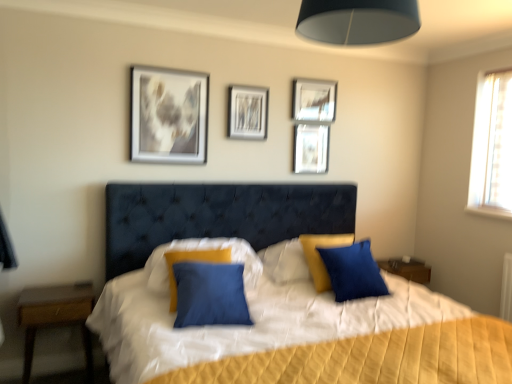
Question: Is wooden nightstand at left shorter than metallic silver picture frame at upper center, which is the 1th picture frame in right-to-left order?

Choices:
 (A) yes
 (B) no

Answer: (B)

Question: Does wooden nightstand at left have a smaller size compared to metallic silver picture frame at upper center, which is the 1th picture frame in right-to-left order?

Choices:
 (A) no
 (B) yes

Answer: (A)

Question: Considering the relative sizes of wooden nightstand at left and metallic silver picture frame at upper center, which is the 1th picture frame in right-to-left order, in the image provided, is wooden nightstand at left thinner than metallic silver picture frame at upper center, which is the 1th picture frame in right-to-left order,?

Choices:
 (A) no
 (B) yes

Answer: (A)

Question: Is wooden nightstand at left positioned behind metallic silver picture frame at upper center, which is the 1th picture frame in right-to-left order?

Choices:
 (A) yes
 (B) no

Answer: (B)

Question: Is wooden nightstand at left facing towards metallic silver picture frame at upper center, which is the 1th picture frame in right-to-left order?

Choices:
 (A) yes
 (B) no

Answer: (B)

Question: Considering their positions, is blue fabric pillow at center, which appears as the 1th pillow when viewed from the right, located in front of or behind black fabric lampshade at upper center?

Choices:
 (A) front
 (B) behind

Answer: (B)

Question: From the image's perspective, is blue fabric pillow at center, acting as the 2th pillow starting from the left, positioned above or below black fabric lampshade at upper center?

Choices:
 (A) below
 (B) above

Answer: (A)

Question: Is blue fabric pillow at center, which appears as the 1th pillow when viewed from the right, wider or thinner than black fabric lampshade at upper center?

Choices:
 (A) wide
 (B) thin

Answer: (B)

Question: Considering the positions of blue fabric pillow at center, acting as the 2th pillow starting from the left, and black fabric lampshade at upper center in the image, is blue fabric pillow at center, acting as the 2th pillow starting from the left, taller or shorter than black fabric lampshade at upper center?

Choices:
 (A) tall
 (B) short

Answer: (A)

Question: Looking at the image, does metallic silver picture frame at upper center, positioned as the 3th picture frame in right-to-left order, seem bigger or smaller compared to metallic silver picture frame at upper center, the 4th picture frame positioned from the left?

Choices:
 (A) small
 (B) big

Answer: (A)

Question: Is metallic silver picture frame at upper center, the 2th picture frame from the left, taller or shorter than metallic silver picture frame at upper center, which is the 1th picture frame in right-to-left order?

Choices:
 (A) tall
 (B) short

Answer: (A)

Question: Relative to metallic silver picture frame at upper center, the 4th picture frame positioned from the left, is metallic silver picture frame at upper center, the 2th picture frame from the left, in front or behind?

Choices:
 (A) front
 (B) behind

Answer: (A)

Question: Which is correct: metallic silver picture frame at upper center, positioned as the 3th picture frame in right-to-left order, is inside metallic silver picture frame at upper center, the 4th picture frame positioned from the left, or outside of it?

Choices:
 (A) outside
 (B) inside

Answer: (A)

Question: Would you say black fabric lampshade at upper center is to the left or to the right of blue fabric pillow at center, which appears as the 1th pillow when viewed from the right, in the picture?

Choices:
 (A) left
 (B) right

Answer: (A)

Question: Is black fabric lampshade at upper center wider or thinner than blue fabric pillow at center, acting as the 2th pillow starting from the left?

Choices:
 (A) thin
 (B) wide

Answer: (B)